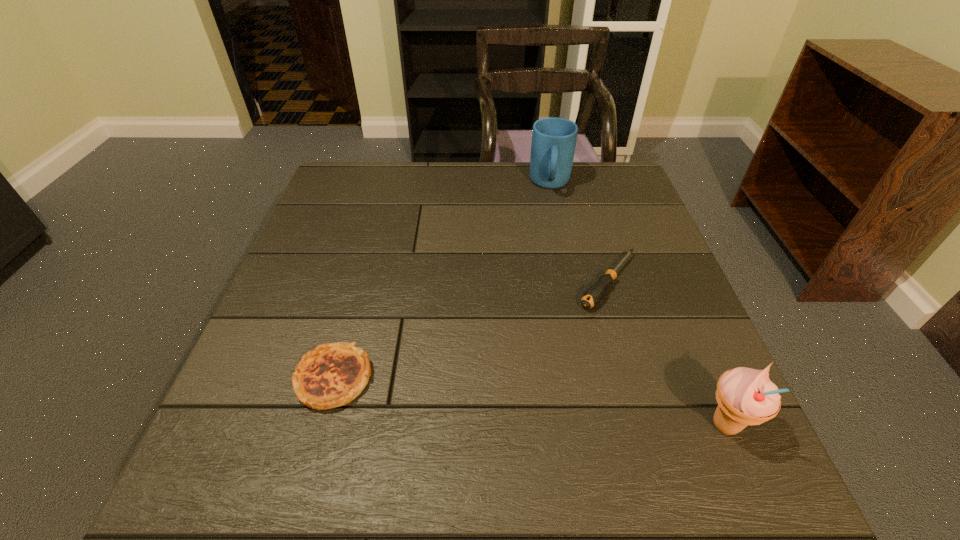
Find the location of a particular element. This screenshot has width=960, height=540. quiche is located at coordinates (333, 374).

Identify the location of icecream. (745, 396).

Locate an element on the screen. The image size is (960, 540). the third nearest object is located at coordinates (595, 293).

I want to click on mug, so click(553, 144).

Where is `blank space located on the right of the quiche`? This screenshot has height=540, width=960. blank space located on the right of the quiche is located at coordinates (435, 378).

Locate an element on the screen. This screenshot has width=960, height=540. vacant region located on the left of the rightmost object is located at coordinates (471, 425).

Identify the location of blank space located at the tip of the screwdriver. (487, 433).

You are a GUI agent. You are given a task and a screenshot of the screen. Output one action in this format:
    pyautogui.click(x=<x>, y=<y>)
    Task: Click on the vacant space located 0.110m at the tip of the screwdriver
    The height and width of the screenshot is (540, 960).
    Given the screenshot: What is the action you would take?
    pyautogui.click(x=567, y=336)

Find the location of a particular element. Image resolution: width=960 pixels, height=540 pixels. vacant space located at the tip of the screwdriver is located at coordinates (552, 355).

What are the coordinates of `vacant space located 0.120m on the side of the farthest object with the handle` in the screenshot? It's located at [552, 227].